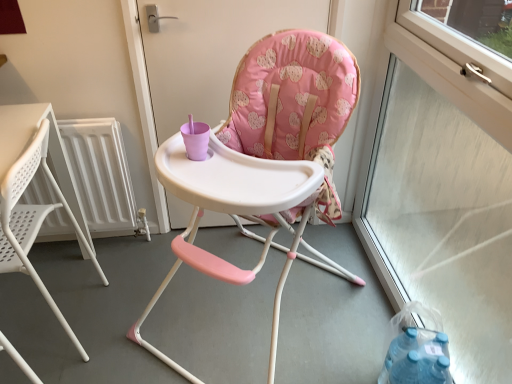
Locate an element on the screen. Image resolution: width=512 pixels, height=384 pixels. vacant space underneath matte plastic highchair at center, which is the 1th chair in right-to-left order (from a real-world perspective) is located at coordinates (251, 315).